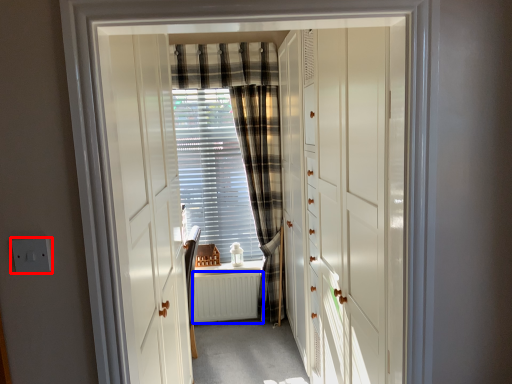
Question: Which object appears farthest to the camera in this image, electric outlet (highlighted by a red box) or radiator (highlighted by a blue box)?

Choices:
 (A) electric outlet
 (B) radiator

Answer: (B)